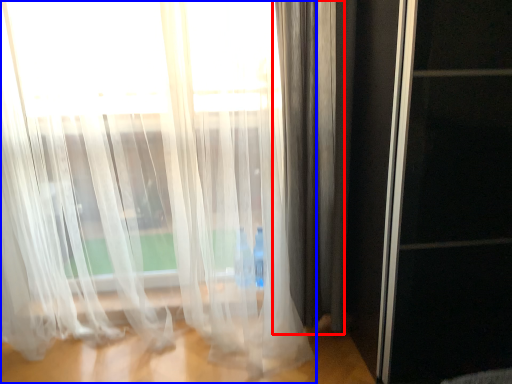
Question: Which object is closer to the camera taking this photo, curtain (highlighted by a red box) or curtain (highlighted by a blue box)?

Choices:
 (A) curtain
 (B) curtain

Answer: (B)